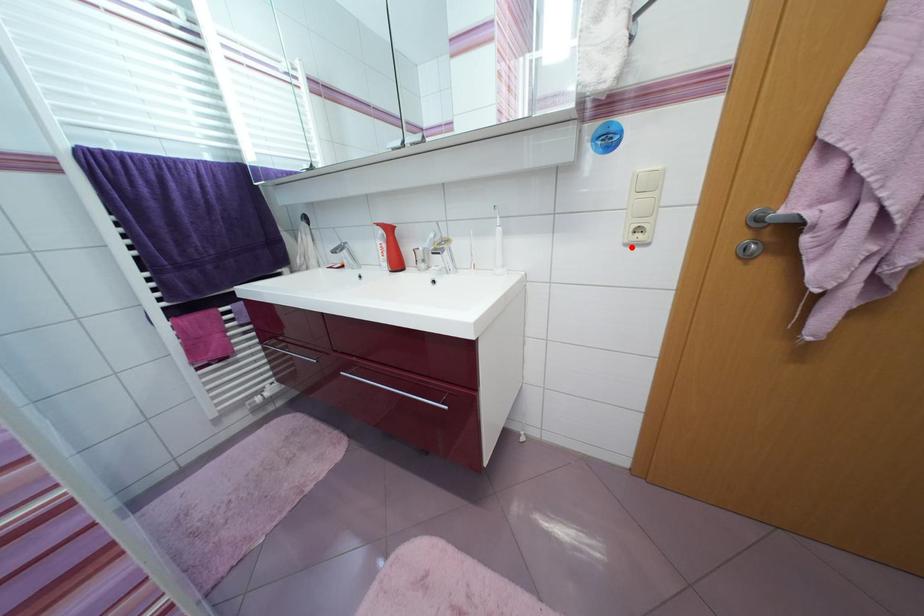
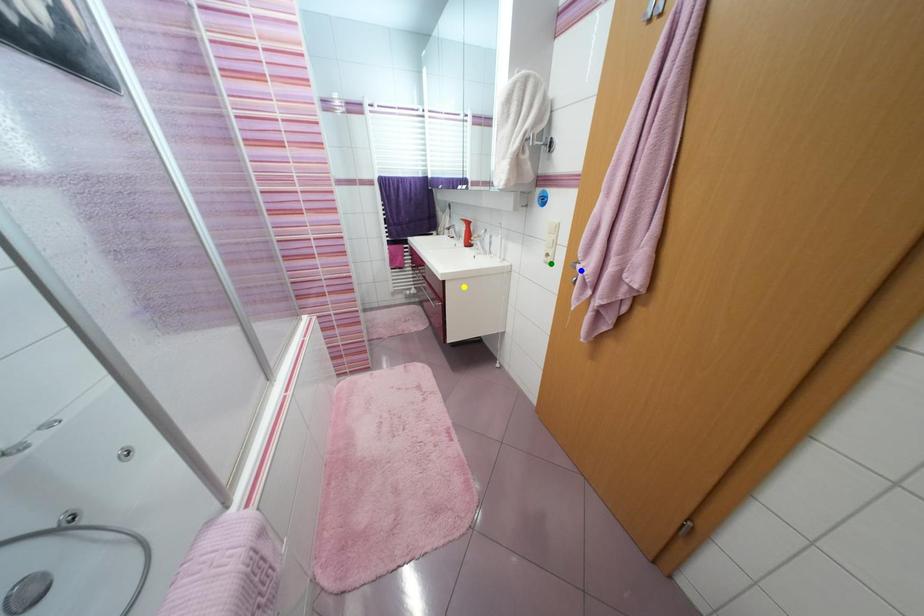
Question: I am providing you with two images of the same scene from different viewpoints. A red point is marked on the first image. You are given multiple points on the second image. Which mark in image 2 goes with the point in image 1?

Choices:
 (A) green point
 (B) blue point
 (C) yellow point

Answer: (A)